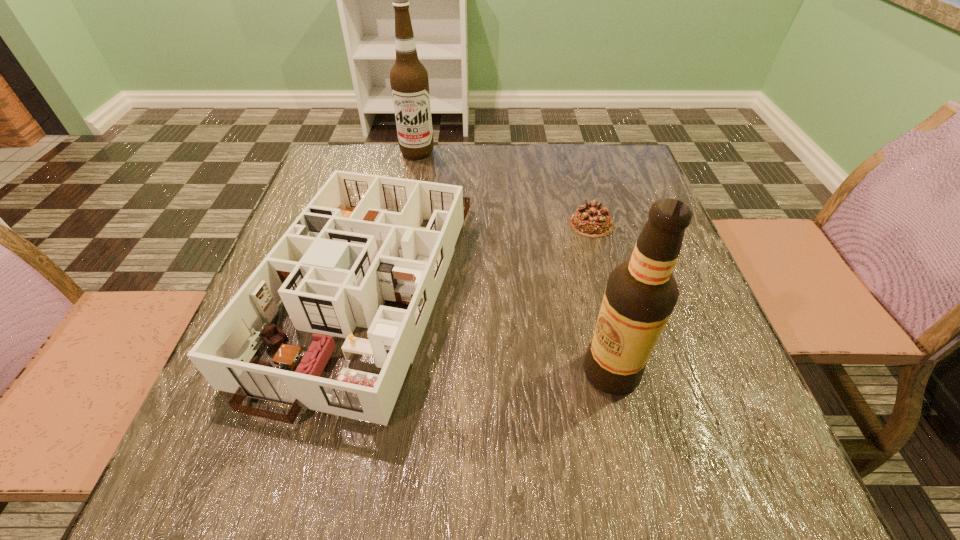
Identify the location of the farthest object. Image resolution: width=960 pixels, height=540 pixels. (409, 81).

Identify the location of the farther alcohol. (409, 81).

Find the location of a particular element. This screenshot has height=540, width=960. the nearer alcohol is located at coordinates (641, 293).

The width and height of the screenshot is (960, 540). What are the coordinates of `dollhouse` in the screenshot? It's located at (359, 242).

At what (x,y) coordinates should I click in order to perform the action: click on the shortest object. Please return your answer as a coordinate pair (x, y). This screenshot has width=960, height=540. Looking at the image, I should click on (591, 220).

Where is `vacant space located 0.340m on the label of the farther alcohol`? Image resolution: width=960 pixels, height=540 pixels. vacant space located 0.340m on the label of the farther alcohol is located at coordinates (400, 245).

Locate an element on the screen. The height and width of the screenshot is (540, 960). vacant space located on the label of the nearer alcohol is located at coordinates (529, 372).

Identify the location of free point located 0.150m on the label of the nearer alcohol. (494, 372).

Find the location of a particular element. vacant space situated 0.050m on the label of the nearer alcohol is located at coordinates (553, 372).

Locate an element on the screen. This screenshot has width=960, height=540. vacant space located on the right of the third tallest object is located at coordinates (652, 284).